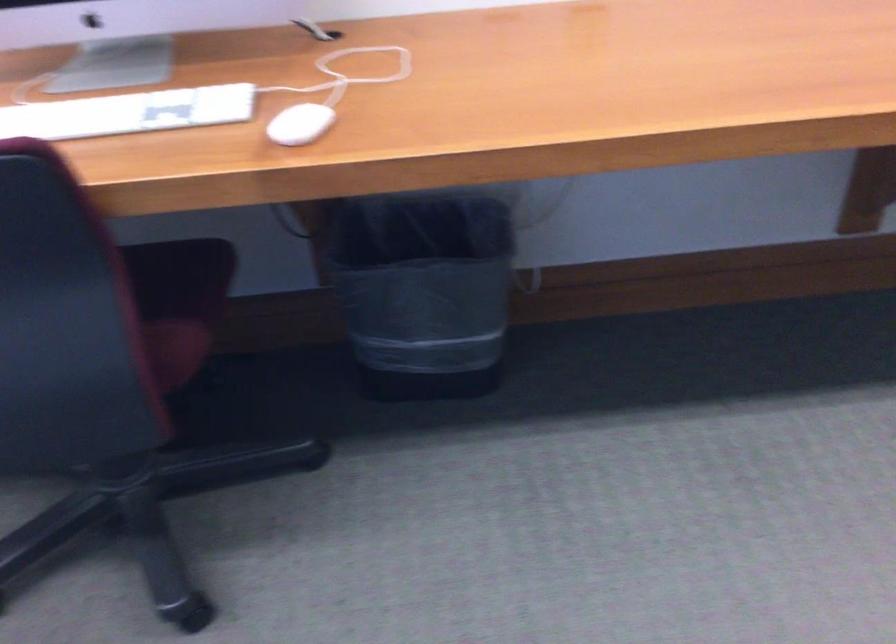
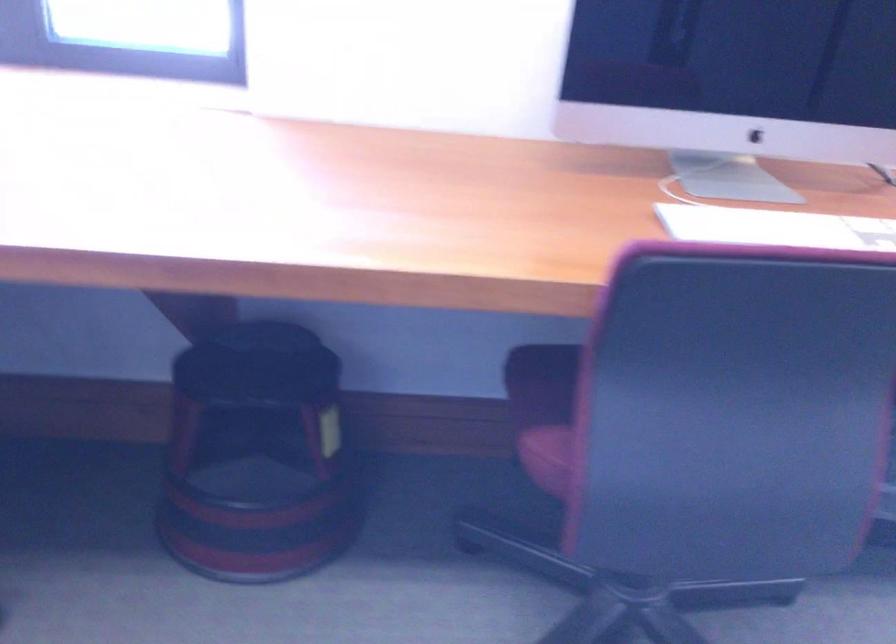
Question: What movement of the cameraman would produce the second image?

Choices:
 (A) Left
 (B) Right
 (C) Forward
 (D) Backward

Answer: (A)